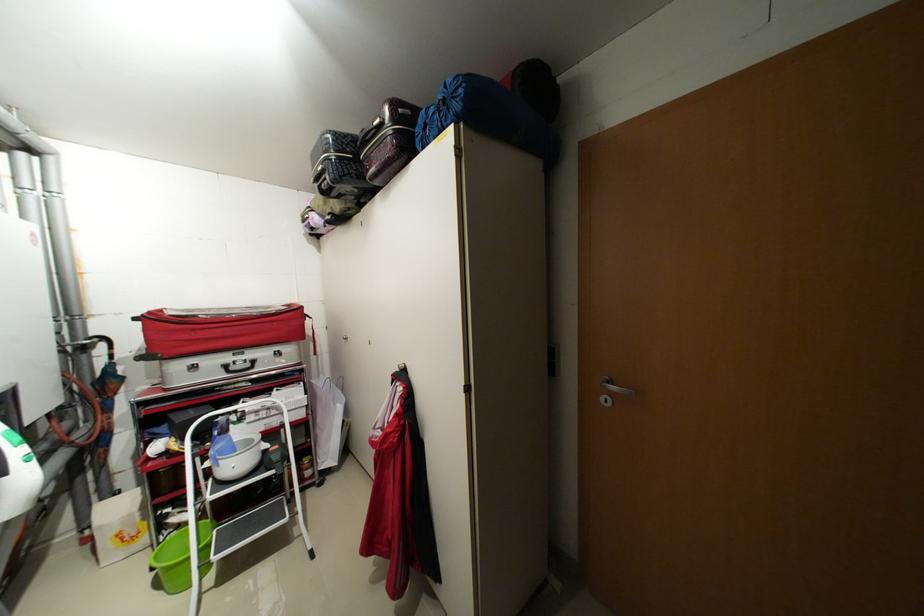
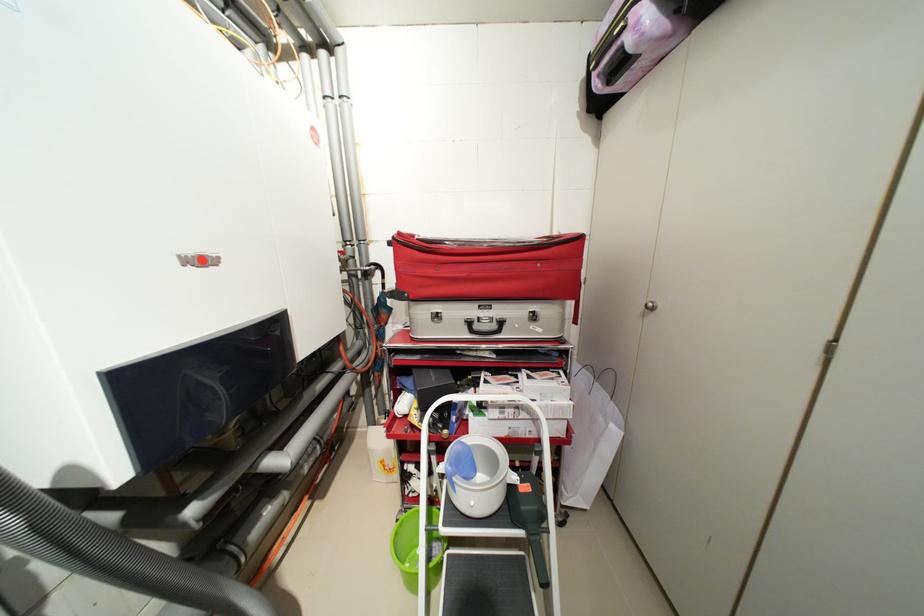
The point at (254, 365) is marked in the first image. Where is the corresponding point in the second image?

(502, 326)